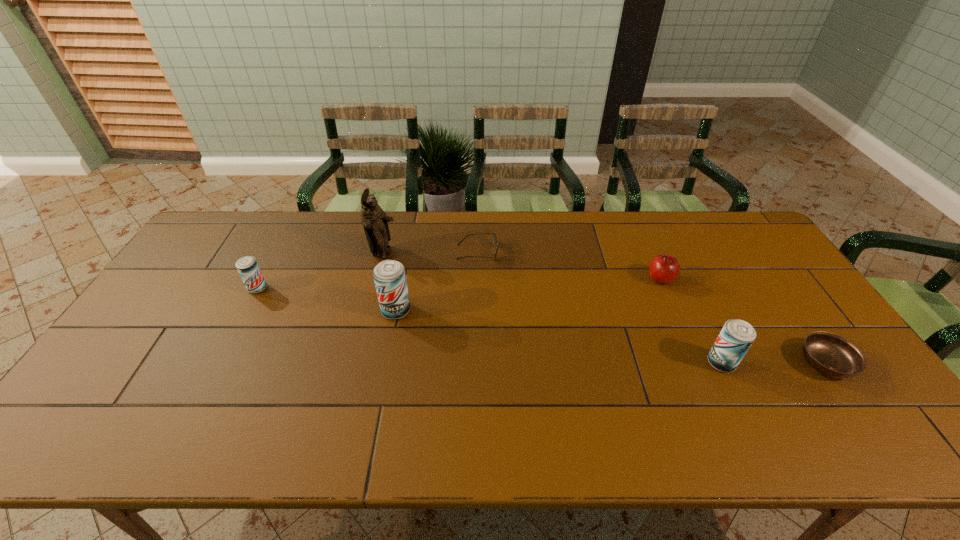
Image resolution: width=960 pixels, height=540 pixels. Identify the location of free location located 0.120m on the left of the leftmost beer can. (209, 288).

Locate an element on the screen. Image resolution: width=960 pixels, height=540 pixels. free space located on the right of the second farthest beer can is located at coordinates 549,310.

The image size is (960, 540). Find the location of `blank area located 0.050m on the front of the rightmost beer can`. blank area located 0.050m on the front of the rightmost beer can is located at coordinates (735, 392).

Locate an element on the screen. The width and height of the screenshot is (960, 540). free space located on the front-facing side of the figurine is located at coordinates (425, 254).

Where is `blank area located on the front-facing side of the fourth object from left to right`? This screenshot has width=960, height=540. blank area located on the front-facing side of the fourth object from left to right is located at coordinates (558, 252).

Where is `vacant space located on the front of the apple`? The width and height of the screenshot is (960, 540). vacant space located on the front of the apple is located at coordinates (697, 362).

You are a GUI agent. You are given a task and a screenshot of the screen. Output one action in this format:
    pyautogui.click(x=<x>, y=<y>)
    Task: Click on the vacant area situated 0.090m on the back of the rightmost object
    
    Given the screenshot: What is the action you would take?
    pyautogui.click(x=794, y=318)

Locate an element on the screen. The image size is (960, 540). figurine present at the far edge is located at coordinates (375, 221).

You are a GUI agent. You are given a task and a screenshot of the screen. Output one action in this format:
    pyautogui.click(x=<x>, y=<y>)
    Task: Click on the sunglasses that is at the far edge
    The image size is (960, 540).
    Given the screenshot: What is the action you would take?
    pyautogui.click(x=495, y=239)

Identify the location of object located at the near edge. [832, 355].